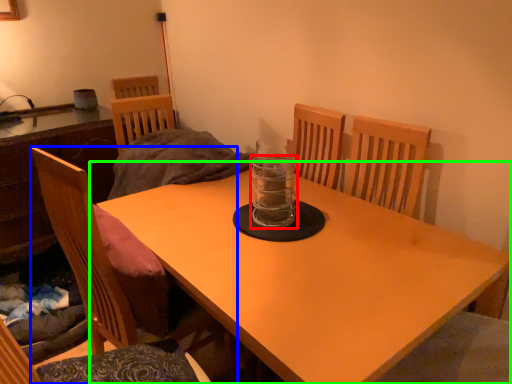
Question: Which is nearer to the glass jar (highlighted by a red box)? chair (highlighted by a blue box) or table (highlighted by a green box).

Choices:
 (A) chair
 (B) table

Answer: (B)